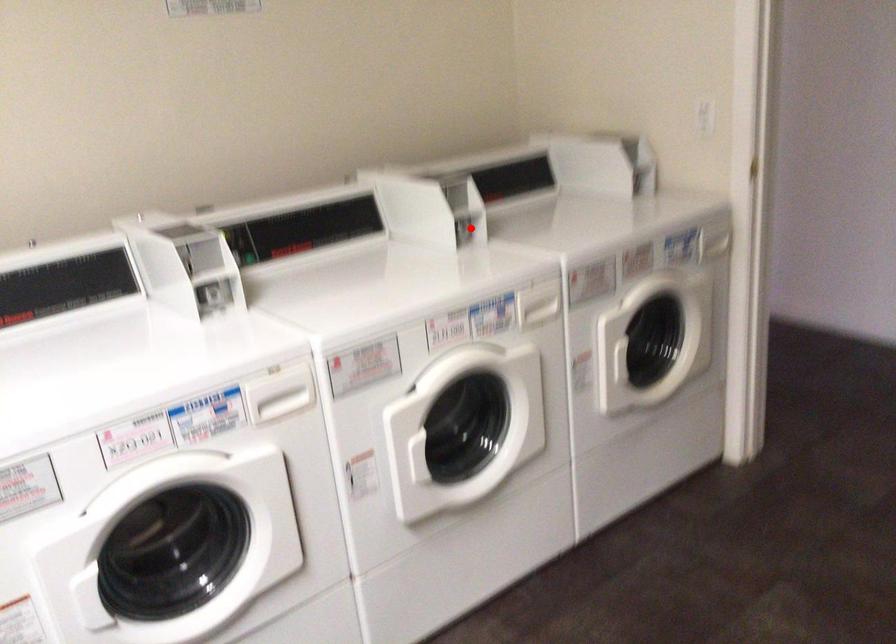
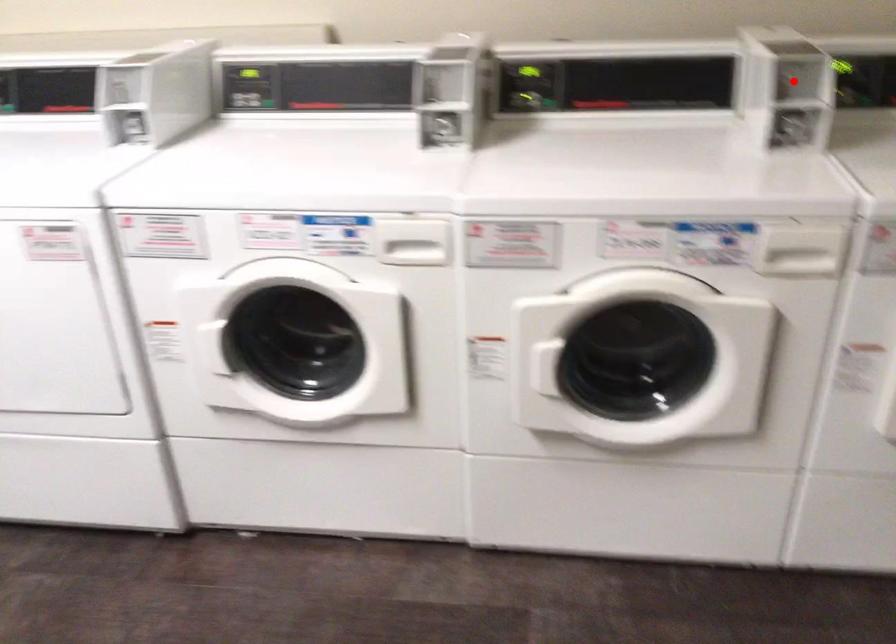
I am providing you with two images of the same scene from different viewpoints. A red point is marked on the first image and another point is marked on the second image. Are the points marked in image1 and image2 representing the same 3D position?

No